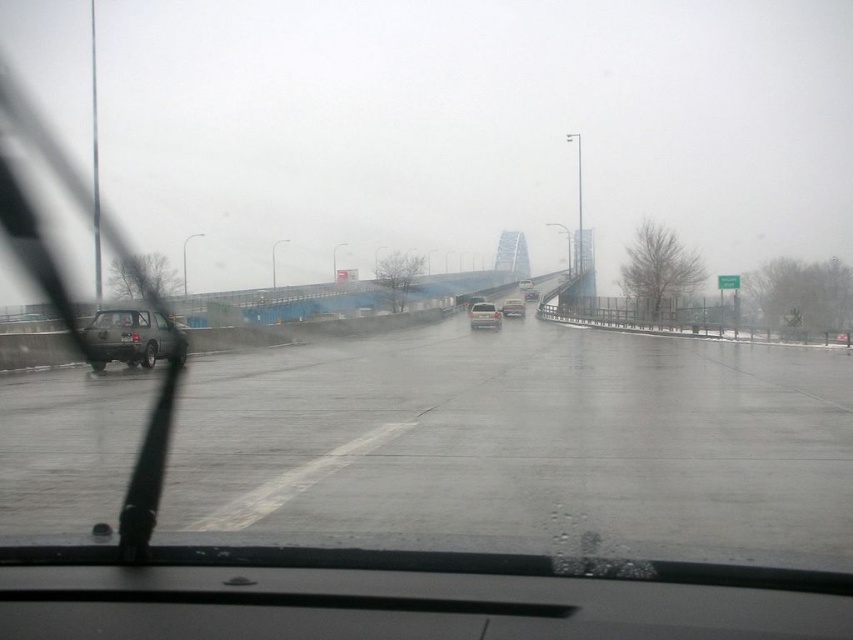
Is the position of matte gray sedan at left less distant than that of matte silver suv at center?

Yes.

Between matte gray sedan at left and matte silver suv at center, which one appears on the left side from the viewer's perspective?

Positioned to the left is matte gray sedan at left.

Identify the location of matte gray sedan at left. The width and height of the screenshot is (853, 640). (131, 337).

Who is shorter, transparent glass windshield at left or matte gray sedan at left?

matte gray sedan at left

Looking at this image, can you confirm if transparent glass windshield at left is positioned below matte gray sedan at left?

No, transparent glass windshield at left is not below matte gray sedan at left.

Find the location of a particular element. transparent glass windshield at left is located at coordinates (149, 307).

Locate an element on the screen. The width and height of the screenshot is (853, 640). transparent glass windshield at left is located at coordinates (x=149, y=307).

Who is positioned more to the left, transparent glass windshield at left or matte silver suv at center?

transparent glass windshield at left is more to the left.

Between transparent glass windshield at left and matte silver suv at center, which one is positioned lower?

matte silver suv at center is below.

Find the location of a particular element. transparent glass windshield at left is located at coordinates (149, 307).